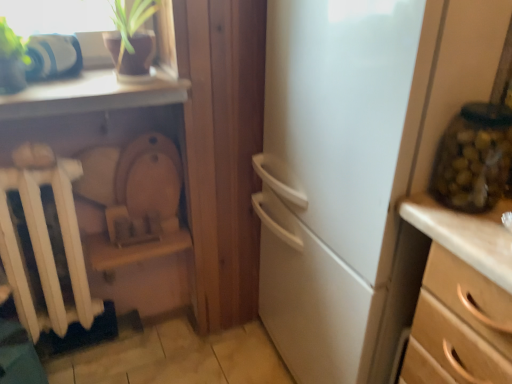
Question: Is wooden chest of drawers at right thinner than white matte radiator at left?

Choices:
 (A) yes
 (B) no

Answer: (B)

Question: Would you say wooden chest of drawers at right is outside white matte radiator at left?

Choices:
 (A) yes
 (B) no

Answer: (A)

Question: Considering the relative sizes of wooden chest of drawers at right and white matte radiator at left in the image provided, is wooden chest of drawers at right smaller than white matte radiator at left?

Choices:
 (A) no
 (B) yes

Answer: (A)

Question: From a real-world perspective, is wooden chest of drawers at right positioned over white matte radiator at left based on gravity?

Choices:
 (A) yes
 (B) no

Answer: (B)

Question: Would you say white matte radiator at left is part of wooden chest of drawers at right's contents?

Choices:
 (A) yes
 (B) no

Answer: (B)

Question: Relative to wooden chest of drawers at right, is green glass jar at right in front or behind?

Choices:
 (A) front
 (B) behind

Answer: (B)

Question: From the image's perspective, relative to wooden chest of drawers at right, is green glass jar at right above or below?

Choices:
 (A) above
 (B) below

Answer: (A)

Question: Considering the positions of green glass jar at right and wooden chest of drawers at right in the image, is green glass jar at right bigger or smaller than wooden chest of drawers at right?

Choices:
 (A) big
 (B) small

Answer: (B)

Question: From a real-world perspective, is green glass jar at right above or below wooden chest of drawers at right?

Choices:
 (A) above
 (B) below

Answer: (A)

Question: From the image's perspective, is wooden chest of drawers at right above or below green glass jar at right?

Choices:
 (A) below
 (B) above

Answer: (A)

Question: Considering the positions of wooden chest of drawers at right and green glass jar at right in the image, is wooden chest of drawers at right wider or thinner than green glass jar at right?

Choices:
 (A) thin
 (B) wide

Answer: (B)

Question: Visually, is wooden chest of drawers at right positioned to the left or to the right of green glass jar at right?

Choices:
 (A) left
 (B) right

Answer: (B)

Question: Relative to green glass jar at right, is wooden chest of drawers at right in front or behind?

Choices:
 (A) behind
 (B) front

Answer: (B)

Question: Is point (450, 178) positioned closer to the camera than point (54, 185)?

Choices:
 (A) farther
 (B) closer

Answer: (B)

Question: From a real-world perspective, is green glass jar at right positioned above or below white matte radiator at left?

Choices:
 (A) above
 (B) below

Answer: (A)